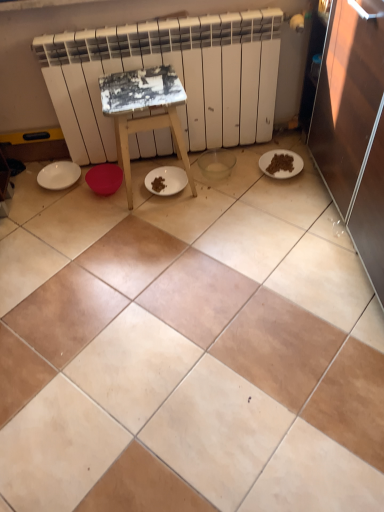
Where is `white matte plate at left, which is counted as the 1th paper plate, starting from the left`? The image size is (384, 512). white matte plate at left, which is counted as the 1th paper plate, starting from the left is located at coordinates (59, 175).

What do you see at coordinates (59, 175) in the screenshot? I see `white matte plate at left, which is counted as the 1th paper plate, starting from the left` at bounding box center [59, 175].

What is the approximate width of beige ceramic tile at center?

beige ceramic tile at center is 1.67 meters wide.

Describe the element at coordinates (281, 164) in the screenshot. I see `white matte plate at lower right, the 1th paper plate when ordered from right to left` at that location.

You are a GUI agent. You are given a task and a screenshot of the screen. Output one action in this format:
    pyautogui.click(x=<x>, y=<y>)
    Task: Click on the white matte plate at left, which is counted as the 1th paper plate, starting from the left
    The image size is (384, 512).
    Given the screenshot: What is the action you would take?
    pyautogui.click(x=59, y=175)

From the picture: From a real-world perspective, is white matte plate at left, which is counted as the 1th paper plate, starting from the left, physically located above or below white painted wood stool at center?

white matte plate at left, which is counted as the 1th paper plate, starting from the left, is situated lower than white painted wood stool at center in the real world.

You are a GUI agent. You are given a task and a screenshot of the screen. Output one action in this format:
    pyautogui.click(x=<x>, y=<y>)
    Task: Click on the paper plate on the left of white painted wood stool at center
    The height and width of the screenshot is (512, 384).
    Given the screenshot: What is the action you would take?
    (x=59, y=175)

Is point (64, 173) closer or farther from the camera than point (114, 77)?

Clearly, point (64, 173) is more distant from the camera than point (114, 77).

Looking at this image, in the image, is white matte plate at left, the 2th paper plate viewed from the right, on the left side or the right side of white painted wood stool at center?

white matte plate at left, the 2th paper plate viewed from the right, is positioned on white painted wood stool at center's left side.

Is white matte radiator at upper center shorter than white matte plate at lower right, the 1th paper plate when ordered from right to left?

No.

Would you say white matte plate at lower right, the 1th paper plate when ordered from right to left, is part of white matte radiator at upper center's contents?

No, white matte plate at lower right, the 1th paper plate when ordered from right to left, is not surrounded by white matte radiator at upper center.

From a real-world perspective, between white matte radiator at upper center and white matte plate at lower right, which is the 2th paper plate from left to right, who is vertically lower?

white matte plate at lower right, which is the 2th paper plate from left to right, is physically lower.

Considering the positions of objects white matte radiator at upper center and white matte plate at lower right, which is the 2th paper plate from left to right, in the image provided, who is more to the right, white matte radiator at upper center or white matte plate at lower right, which is the 2th paper plate from left to right,?

From the viewer's perspective, white matte plate at lower right, which is the 2th paper plate from left to right, appears more on the right side.

Looking at their sizes, would you say beige ceramic tile at center is wider or thinner than white matte plate at lower right, which is the 2th paper plate from left to right?

beige ceramic tile at center is wider than white matte plate at lower right, which is the 2th paper plate from left to right.

Find the location of `ceramic tile below the white matte plate at lower right, the 1th paper plate when ordered from right to left (from the image's perspective)`. ceramic tile below the white matte plate at lower right, the 1th paper plate when ordered from right to left (from the image's perspective) is located at coordinates (188, 348).

From a real-world perspective, between beige ceramic tile at center and white matte plate at lower right, the 1th paper plate when ordered from right to left, who is vertically higher?

In real-world perspective, white matte plate at lower right, the 1th paper plate when ordered from right to left, is above.

From the image's perspective, which one is positioned lower, beige ceramic tile at center or white matte plate at lower right, which is the 2th paper plate from left to right?

From the image's view, beige ceramic tile at center is below.

I want to click on furniture that appears below the white matte radiator at upper center (from the image's perspective), so click(x=143, y=111).

Between white matte radiator at upper center and white painted wood stool at center, which one appears on the left side from the viewer's perspective?

white painted wood stool at center is more to the left.

Can you confirm if white matte radiator at upper center is taller than white painted wood stool at center?

Correct, white matte radiator at upper center is much taller as white painted wood stool at center.

Is white matte radiator at upper center closer to the viewer compared to white painted wood stool at center?

No, it is behind white painted wood stool at center.

Is white painted wood stool at center positioned with its back to white matte plate at left, the 2th paper plate viewed from the right?

No, white painted wood stool at center is not facing away from white matte plate at left, the 2th paper plate viewed from the right.

Is white painted wood stool at center not within white matte plate at left, which is counted as the 1th paper plate, starting from the left?

white painted wood stool at center is positioned outside white matte plate at left, which is counted as the 1th paper plate, starting from the left.

Would you say white painted wood stool at center is a long distance from white matte plate at left, the 2th paper plate viewed from the right?

white painted wood stool at center is actually quite close to white matte plate at left, the 2th paper plate viewed from the right.

The height and width of the screenshot is (512, 384). In order to click on furniture above the white matte plate at left, which is counted as the 1th paper plate, starting from the left (from a real-world perspective) in this screenshot , I will do `click(143, 111)`.

From a real-world perspective, is white matte plate at lower right, which is the 2th paper plate from left to right, beneath white painted wood stool at center?

Yes, from a real-world perspective, white matte plate at lower right, which is the 2th paper plate from left to right, is below white painted wood stool at center.

Considering the sizes of objects white matte plate at lower right, the 1th paper plate when ordered from right to left, and white painted wood stool at center in the image provided, who is shorter, white matte plate at lower right, the 1th paper plate when ordered from right to left, or white painted wood stool at center?

white matte plate at lower right, the 1th paper plate when ordered from right to left, is shorter.

From the image's perspective, between white matte plate at lower right, which is the 2th paper plate from left to right, and white painted wood stool at center, which one is located above?

From the image's view, white painted wood stool at center is above.

Is white matte plate at lower right, which is the 2th paper plate from left to right, touching white painted wood stool at center?

No, white matte plate at lower right, which is the 2th paper plate from left to right, is not next to white painted wood stool at center.

Where is `paper plate on the left side of beige ceramic tile at center`? Image resolution: width=384 pixels, height=512 pixels. paper plate on the left side of beige ceramic tile at center is located at coordinates (59, 175).

From the image's perspective, between white matte plate at left, which is counted as the 1th paper plate, starting from the left, and beige ceramic tile at center, which one is located above?

white matte plate at left, which is counted as the 1th paper plate, starting from the left.

Is white matte plate at left, the 2th paper plate viewed from the right, taller than beige ceramic tile at center?

Yes, white matte plate at left, the 2th paper plate viewed from the right, is taller than beige ceramic tile at center.

The image size is (384, 512). I want to click on furniture lying on the right of white matte plate at left, which is counted as the 1th paper plate, starting from the left, so click(143, 111).

At what (x,y) coordinates should I click in order to perform the action: click on the 1st paper plate behind the white matte radiator at upper center, starting your count from the anchor. Please return your answer as a coordinate pair (x, y). Image resolution: width=384 pixels, height=512 pixels. Looking at the image, I should click on (281, 164).

Which object lies nearer to the anchor point beige ceramic tile at center, white matte radiator at upper center or white matte plate at left, the 2th paper plate viewed from the right?

white matte radiator at upper center.

Estimate the real-world distances between objects in this image. Which object is closer to white matte plate at lower right, which is the 2th paper plate from left to right, white matte radiator at upper center or white matte plate at left, the 2th paper plate viewed from the right?

The object closer to white matte plate at lower right, which is the 2th paper plate from left to right, is white matte radiator at upper center.

Considering their positions, is white painted wood stool at center positioned further to beige ceramic tile at center than white matte plate at left, the 2th paper plate viewed from the right?

white matte plate at left, the 2th paper plate viewed from the right, is further to beige ceramic tile at center.

Which object lies nearer to the anchor point beige ceramic tile at center, white painted wood stool at center or white matte radiator at upper center?

white painted wood stool at center lies closer to beige ceramic tile at center than the other object.

Considering their positions, is white painted wood stool at center positioned closer to white matte plate at lower right, which is the 2th paper plate from left to right, than beige ceramic tile at center?

white painted wood stool at center is closer to white matte plate at lower right, which is the 2th paper plate from left to right.

From the image, which object appears to be nearer to white matte plate at lower right, the 1th paper plate when ordered from right to left, beige ceramic tile at center or white painted wood stool at center?

white painted wood stool at center is closer to white matte plate at lower right, the 1th paper plate when ordered from right to left.

Looking at the image, which one is located further to beige ceramic tile at center, white matte plate at left, which is counted as the 1th paper plate, starting from the left, or white matte plate at lower right, which is the 2th paper plate from left to right?

Based on the image, white matte plate at left, which is counted as the 1th paper plate, starting from the left, appears to be further to beige ceramic tile at center.

Based on their spatial positions, is white matte radiator at upper center or white painted wood stool at center further from beige ceramic tile at center?

white matte radiator at upper center is positioned further to the anchor beige ceramic tile at center.

Locate an element on the screen. furniture positioned between beige ceramic tile at center and white matte plate at lower right, which is the 2th paper plate from left to right, from near to far is located at coordinates (143, 111).

Locate an element on the screen. This screenshot has height=512, width=384. radiator situated between white painted wood stool at center and white matte plate at lower right, the 1th paper plate when ordered from right to left, from left to right is located at coordinates (177, 74).

Find the location of a particular element. This screenshot has width=384, height=512. radiator between white matte plate at left, which is counted as the 1th paper plate, starting from the left, and white matte plate at lower right, which is the 2th paper plate from left to right, in the horizontal direction is located at coordinates (177, 74).

This screenshot has height=512, width=384. In order to click on furniture between beige ceramic tile at center and white matte plate at left, which is counted as the 1th paper plate, starting from the left, along the z-axis in this screenshot , I will do `click(143, 111)`.